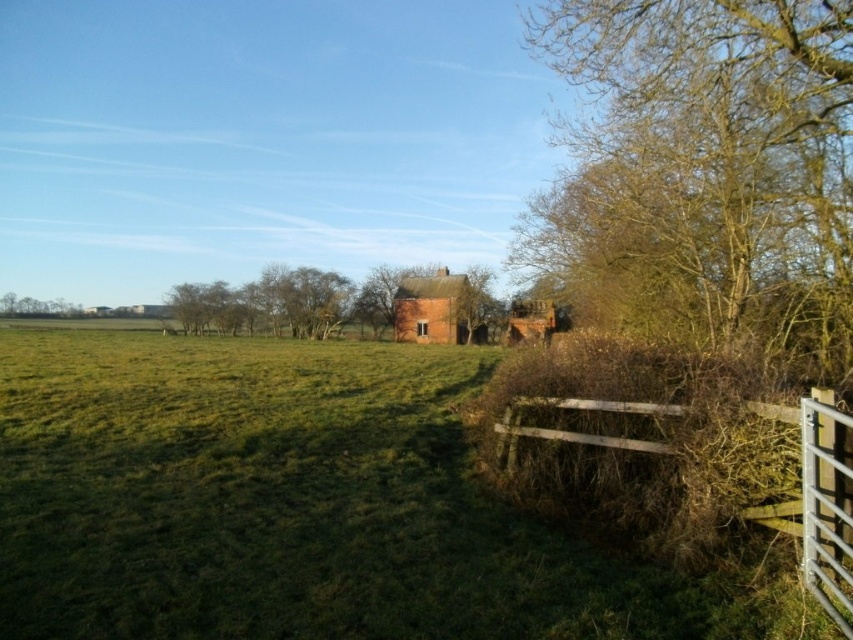
You are standing in the rural landscape and want to locate the point at coordinates (711, 161). Based on the scene description, where would this point be located?

The point at coordinates (711, 161) is located on the brown leafless tree at upper right.

You are a bird looking for a high perch to survey the entire rural landscape. Which object, the brown leafless tree at upper right or the rustic wooden barn at center, would provide a higher vantage point?

The brown leafless tree at upper right is much taller than the rustic wooden barn at center, so it would provide a higher vantage point for the bird to survey the entire rural landscape.

You are planning to plant a new tree exactly halfway between the brown leafless tree at upper right and the rustic wooden barn at center. How far will this new tree be from each of the existing trees?

The new tree will be 16.105 meters away from both the brown leafless tree at upper right and the rustic wooden barn at center since it is placed exactly halfway between them.